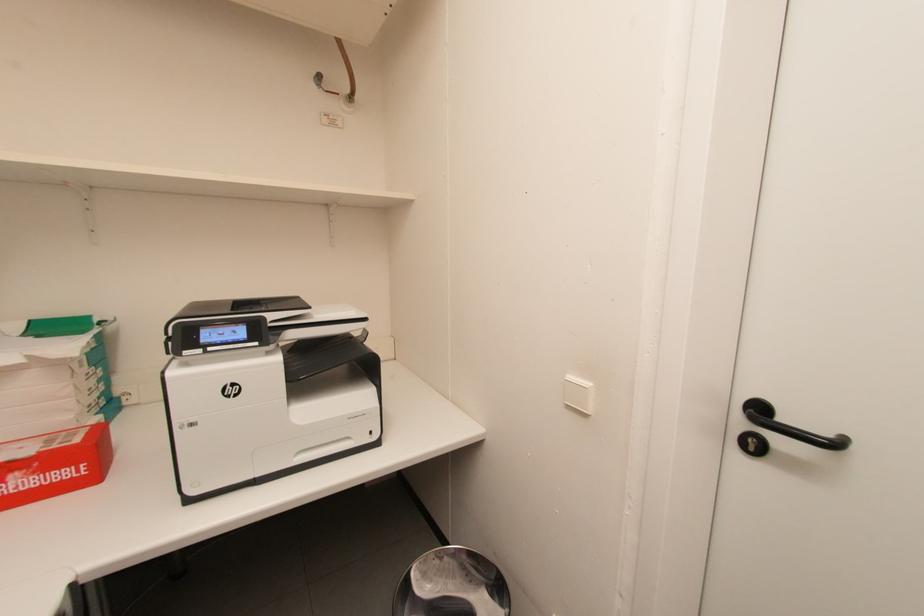
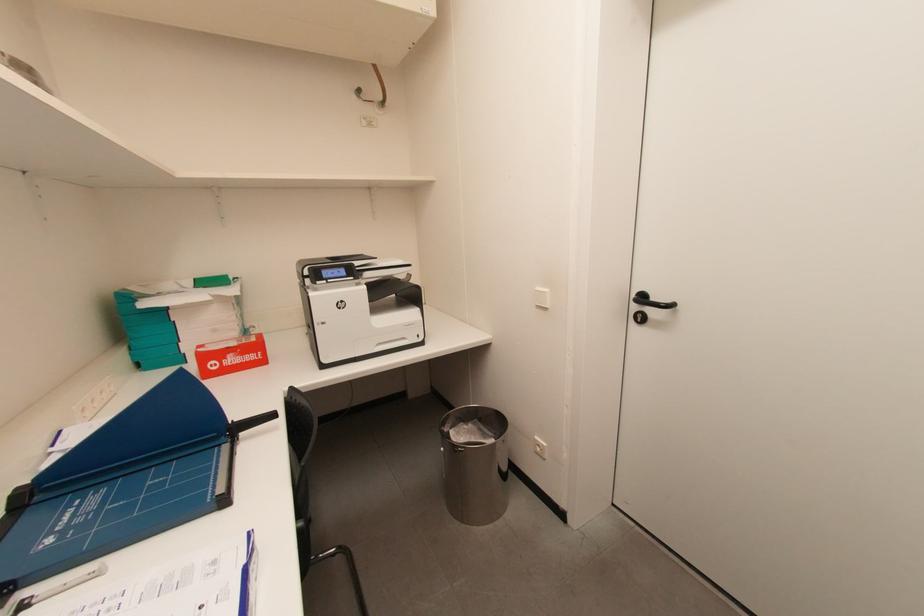
Question: How did the camera likely rotate?

Choices:
 (A) Left
 (B) Right
 (C) Up
 (D) Down

Answer: (D)